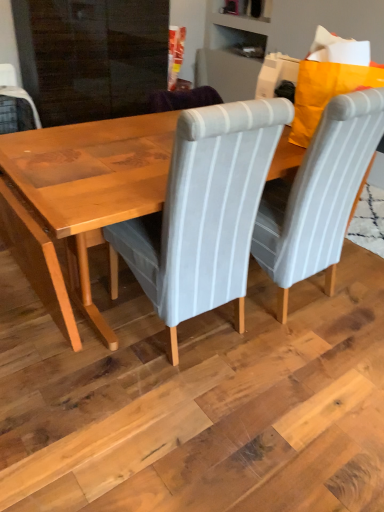
Question: In which direction should I rotate to look at light gray fabric chair at center, the 2th chair from the right?

Choices:
 (A) right
 (B) left

Answer: (B)

Question: Is light gray fabric chair at center, the 1th chair positioned from the left, beside wooden table at center?

Choices:
 (A) no
 (B) yes

Answer: (A)

Question: Does light gray fabric chair at center, the 1th chair positioned from the left, come in front of wooden table at center?

Choices:
 (A) no
 (B) yes

Answer: (A)

Question: Does light gray fabric chair at center, the 2th chair from the right, turn towards wooden table at center?

Choices:
 (A) no
 (B) yes

Answer: (A)

Question: From the image's perspective, would you say light gray fabric chair at center, the 1th chair positioned from the left, is positioned over wooden table at center?

Choices:
 (A) yes
 (B) no

Answer: (A)

Question: Would you consider light gray fabric chair at center, the 1th chair positioned from the left, to be distant from wooden table at center?

Choices:
 (A) no
 (B) yes

Answer: (A)

Question: Considering the relative sizes of light gray fabric chair at center, the 2th chair from the right, and wooden table at center in the image provided, is light gray fabric chair at center, the 2th chair from the right, smaller than wooden table at center?

Choices:
 (A) no
 (B) yes

Answer: (B)

Question: Is gray striped fabric chair at center, which ranks as the second chair in left-to-right order, at the left side of wooden table at center?

Choices:
 (A) yes
 (B) no

Answer: (B)

Question: Is wooden table at center completely or partially inside gray striped fabric chair at center, the 1th chair in the right-to-left sequence?

Choices:
 (A) yes
 (B) no

Answer: (B)

Question: Can you confirm if gray striped fabric chair at center, which ranks as the second chair in left-to-right order, is thinner than wooden table at center?

Choices:
 (A) yes
 (B) no

Answer: (A)

Question: Is gray striped fabric chair at center, which ranks as the second chair in left-to-right order, positioned with its back to wooden table at center?

Choices:
 (A) yes
 (B) no

Answer: (B)

Question: Is gray striped fabric chair at center, the 1th chair in the right-to-left sequence, far away from wooden table at center?

Choices:
 (A) no
 (B) yes

Answer: (A)

Question: Does gray striped fabric chair at center, the 1th chair in the right-to-left sequence, appear on the right side of wooden table at center?

Choices:
 (A) no
 (B) yes

Answer: (B)

Question: Does gray striped fabric chair at center, the 1th chair in the right-to-left sequence, appear on the right side of light gray fabric chair at center, the 1th chair positioned from the left?

Choices:
 (A) no
 (B) yes

Answer: (B)